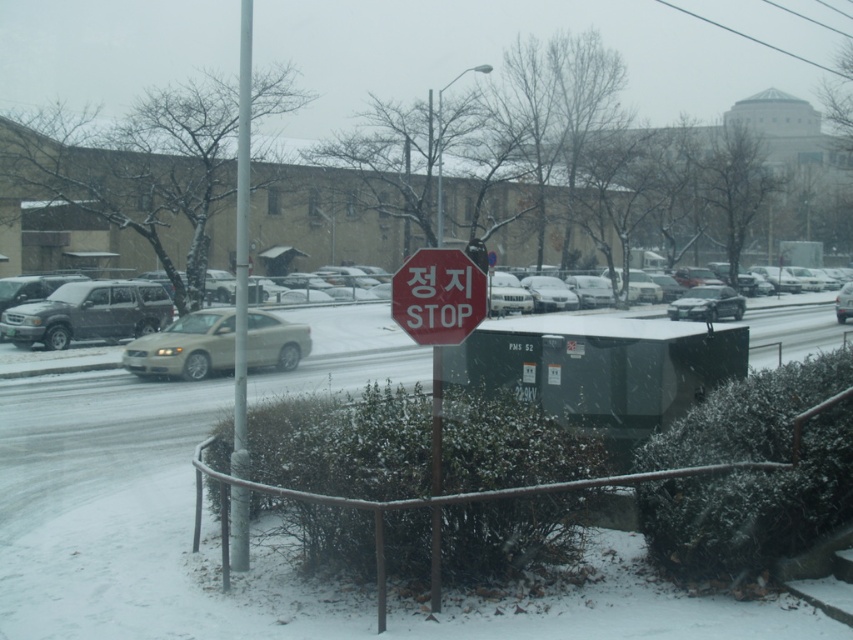
From the picture: Which is below, satin beige sedan at center or metallic pole at center?

Positioned lower is satin beige sedan at center.

Is point (136, 344) positioned after point (239, 72)?

No, it is not.

Identify the location of satin beige sedan at center. (184, 346).

Which of these two, matte gray suv at left or red matte stop sign at center, stands taller?

matte gray suv at left is taller.

Is matte gray suv at left taller than red matte stop sign at center?

Indeed, matte gray suv at left has a greater height compared to red matte stop sign at center.

Between point (32, 310) and point (413, 310), which one is positioned in front?

Point (413, 310)

Locate an element on the screen. This screenshot has width=853, height=640. matte gray suv at left is located at coordinates (88, 314).

Is satin beige sedan at center shorter than red matte stop sign at center?

No.

Who is positioned more to the left, satin beige sedan at center or red matte stop sign at center?

From the viewer's perspective, satin beige sedan at center appears more on the left side.

Does point (194, 316) come in front of point (477, 288)?

No.

Identify the location of satin beige sedan at center. This screenshot has height=640, width=853. (184, 346).